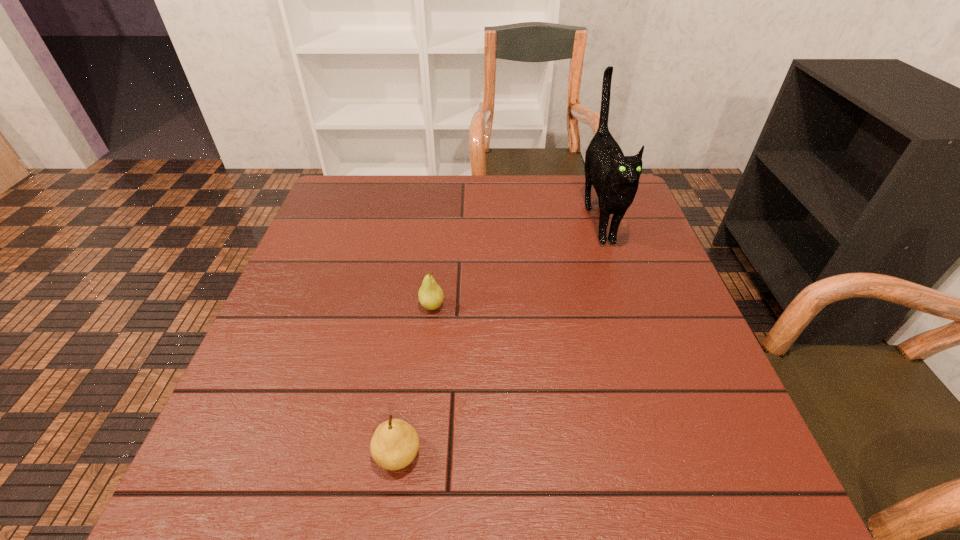
Find the location of `object at the far right corner`. object at the far right corner is located at coordinates (615, 177).

You are a GUI agent. You are given a task and a screenshot of the screen. Output one action in this format:
    pyautogui.click(x=<x>, y=<y>)
    Task: Click on the vacant region at the far edge of the desktop
    Image resolution: width=960 pixels, height=540 pixels.
    Given the screenshot: What is the action you would take?
    pyautogui.click(x=466, y=176)

In order to click on vacant space at the near edge of the desktop in this screenshot , I will do `click(419, 491)`.

The height and width of the screenshot is (540, 960). I want to click on vacant space at the left edge of the desktop, so click(355, 246).

The width and height of the screenshot is (960, 540). In order to click on vacant space at the right edge of the desktop in this screenshot , I will do `click(705, 368)`.

The height and width of the screenshot is (540, 960). Find the location of `free space at the far left corner of the desktop`. free space at the far left corner of the desktop is located at coordinates (326, 207).

Locate an element on the screen. Image resolution: width=960 pixels, height=540 pixels. free location at the near left corner of the desktop is located at coordinates (248, 486).

Find the location of a particular element. Image resolution: width=960 pixels, height=540 pixels. vacant space at the near right corner is located at coordinates (737, 481).

Locate an element on the screen. free area in between the nearer pear and the second farthest object is located at coordinates (415, 380).

Where is `vacant area that lies between the rightmost object and the nearer pear`? vacant area that lies between the rightmost object and the nearer pear is located at coordinates (498, 336).